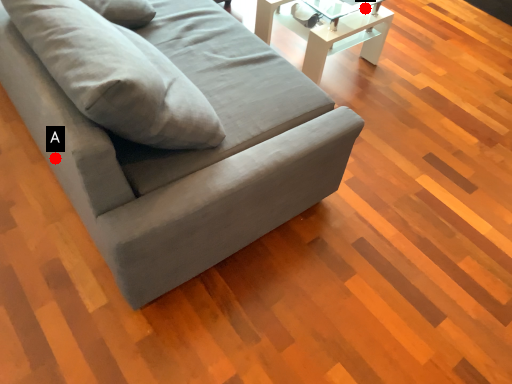
Question: Two points are circled on the image, labeled by A and B beside each circle. Which point appears farthest from the camera in this image?

Choices:
 (A) A is further
 (B) B is further

Answer: (B)